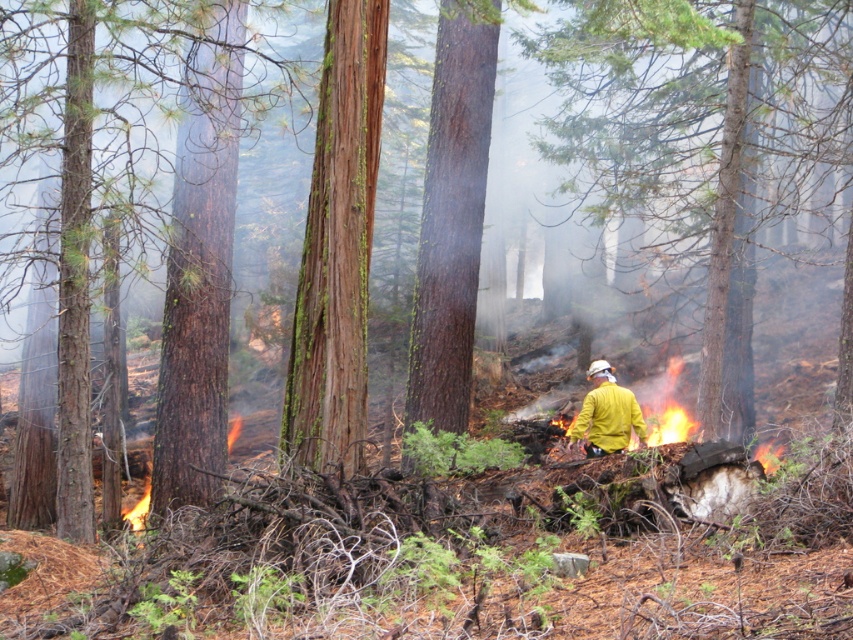
In the scene shown: You are a firefighter in the forest and need to move from your current position to the flame wood fire at lower left to assess its spread. Which direction should you move relative to the yellow matte jacket at center?

The yellow matte jacket at center is to the right of the flame wood fire at lower left, so you should move to the left to reach the flame wood fire at lower left from the jacket.

You are a firefighter assessing the fire risk in the forest. You notice two trees in the center of the scene, a smooth bark tree at center and a green mossy bark tree at center. Which tree has a larger diameter?

The smooth bark tree at center has a larger diameter than the green mossy bark tree at center, as its width surpasses the latter.